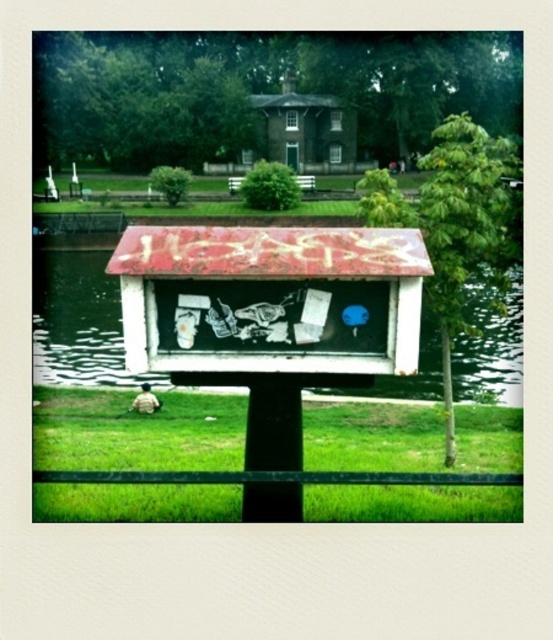
Between smooth water at center and dark green wooden hut at center, which one has more height?

Standing taller between the two is dark green wooden hut at center.

Is smooth water at center above dark green wooden hut at center?

No.

Image resolution: width=553 pixels, height=640 pixels. In order to click on smooth water at center in this screenshot , I will do `click(77, 321)`.

Who is positioned more to the right, green grass at lower center or smooth water at center?

green grass at lower center

Can you confirm if green grass at lower center is thinner than smooth water at center?

Indeed, green grass at lower center has a lesser width compared to smooth water at center.

This screenshot has height=640, width=553. I want to click on green grass at lower center, so click(x=138, y=432).

Is green grass at lower center positioned before dark green wooden hut at center?

Yes, it is.

Is green grass at lower center further to the viewer compared to dark green wooden hut at center?

No, green grass at lower center is closer to the viewer.

Does point (117, 436) lie in front of point (294, 93)?

That is True.

You are a GUI agent. You are given a task and a screenshot of the screen. Output one action in this format:
    pyautogui.click(x=<x>, y=<y>)
    Task: Click on the green grass at lower center
    This screenshot has width=553, height=640.
    Given the screenshot: What is the action you would take?
    pyautogui.click(x=138, y=432)